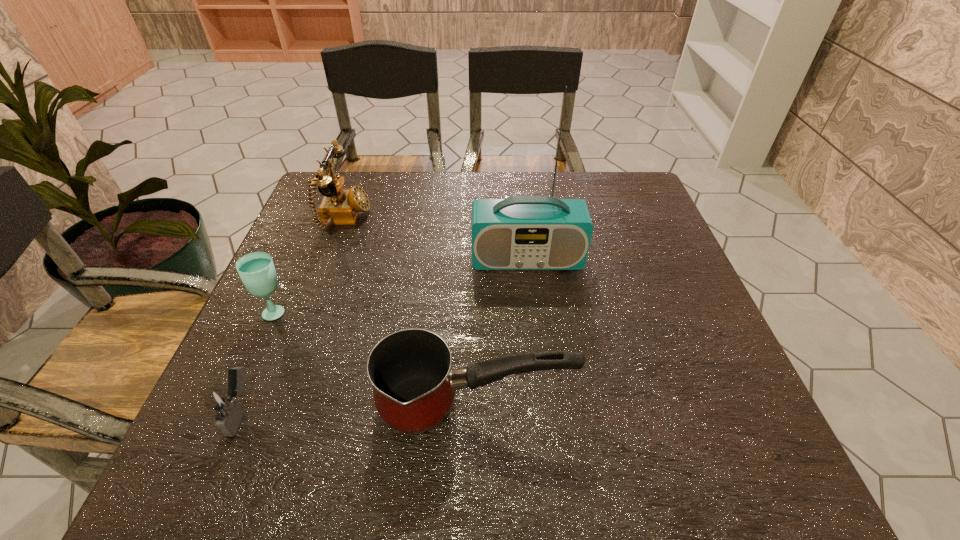
At what (x,y) coordinates should I click in order to perform the action: click on vacant area at the left edge of the desktop. Please return your answer as a coordinate pair (x, y). This screenshot has width=960, height=540. Looking at the image, I should click on (245, 349).

Image resolution: width=960 pixels, height=540 pixels. In the image, there is a desktop. In order to click on free space at the right edge in this screenshot , I will do `click(684, 342)`.

Where is `vacant space at the far right corner of the desktop`? This screenshot has height=540, width=960. vacant space at the far right corner of the desktop is located at coordinates (610, 210).

What are the coordinates of `free spot between the tallest object and the glass` in the screenshot? It's located at (401, 285).

The width and height of the screenshot is (960, 540). I want to click on free space between the tallest object and the saucepan, so click(501, 333).

You are a GUI agent. You are given a task and a screenshot of the screen. Output one action in this format:
    pyautogui.click(x=<x>, y=<y>)
    Task: Click on the vacant point located between the glass and the igniter
    
    Given the screenshot: What is the action you would take?
    pyautogui.click(x=259, y=361)

This screenshot has height=540, width=960. What are the coordinates of `vacant area between the third farthest object and the tallest object` in the screenshot? It's located at (401, 285).

Locate an element on the screen. free space between the shortest object and the glass is located at coordinates coord(259,361).

Locate an element on the screen. free space between the saucepan and the shortest object is located at coordinates (358, 408).

This screenshot has height=540, width=960. I want to click on empty space between the third nearest object and the tallest object, so click(401, 285).